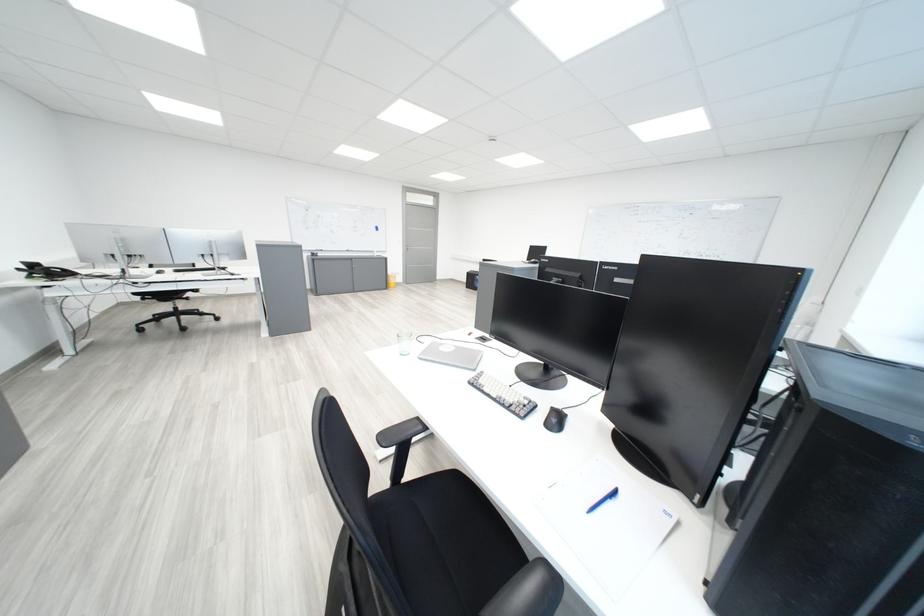
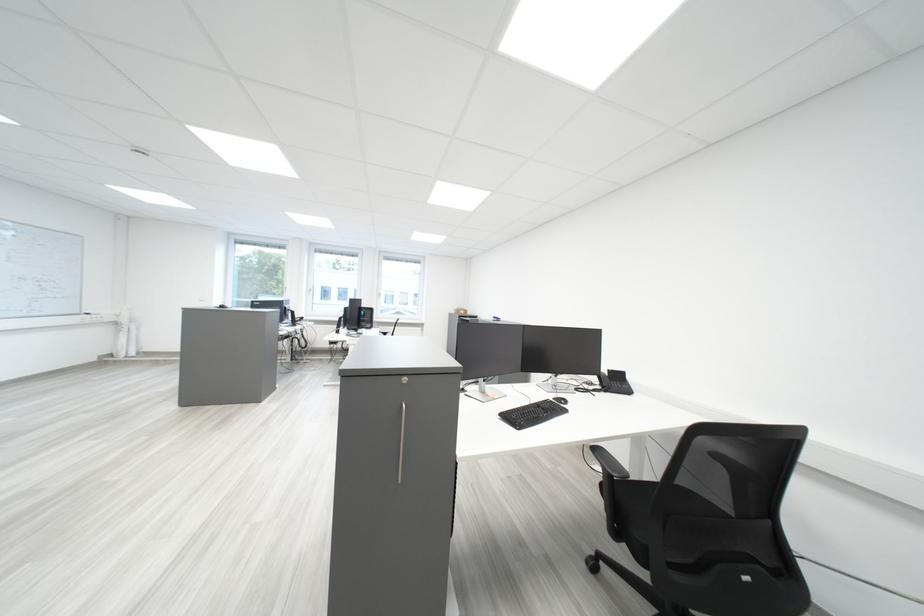
Question: I am providing you with two images of the same scene from different viewpoints. Please identify which objects are invisible in image2.

Choices:
 (A) black computer mouse
 (B) telephone handset
 (C) chair sitting surface
 (D) black drawer pull

Answer: (A)